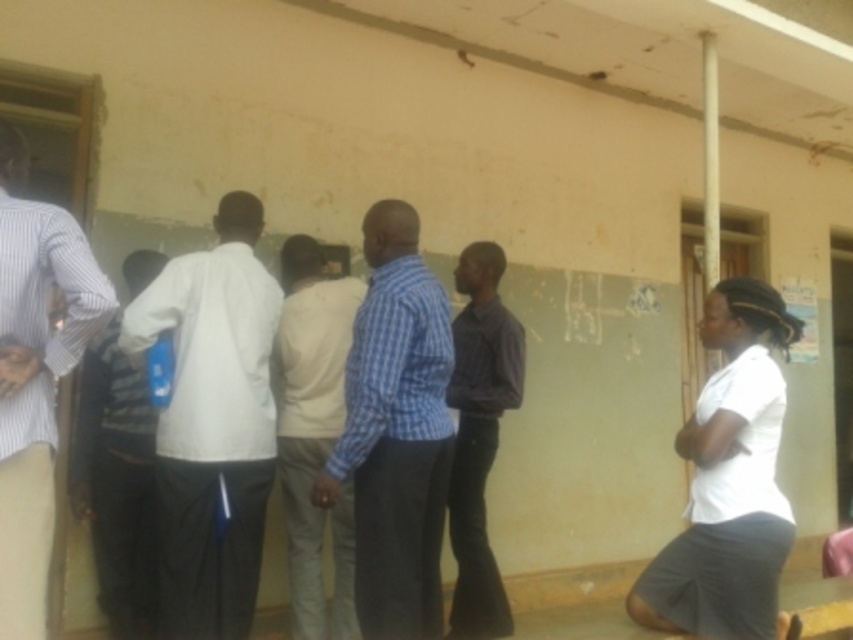
Is light beige cotton shirt at center smaller than striped fabric shirt at left?

No, light beige cotton shirt at center is not smaller than striped fabric shirt at left.

Does light beige cotton shirt at center appear under striped fabric shirt at left?

Incorrect, light beige cotton shirt at center is not positioned below striped fabric shirt at left.

This screenshot has height=640, width=853. Identify the location of light beige cotton shirt at center. (308, 410).

Which is in front, point (27, 252) or point (463, 269)?

Point (27, 252) is more forward.

In the scene shown: Does striped cotton shirt at left appear under purple shirt at center?

No, striped cotton shirt at left is not below purple shirt at center.

Between point (28, 308) and point (498, 618), which one is positioned behind?

The point (498, 618) is more distant.

Image resolution: width=853 pixels, height=640 pixels. I want to click on striped cotton shirt at left, so click(x=33, y=376).

Consider the image. Who is shorter, white matte shirt at center or blue checkered shirt at center?

blue checkered shirt at center is shorter.

I want to click on white matte shirt at center, so click(212, 422).

Locate an element on the screen. This screenshot has width=853, height=640. white matte shirt at center is located at coordinates (212, 422).